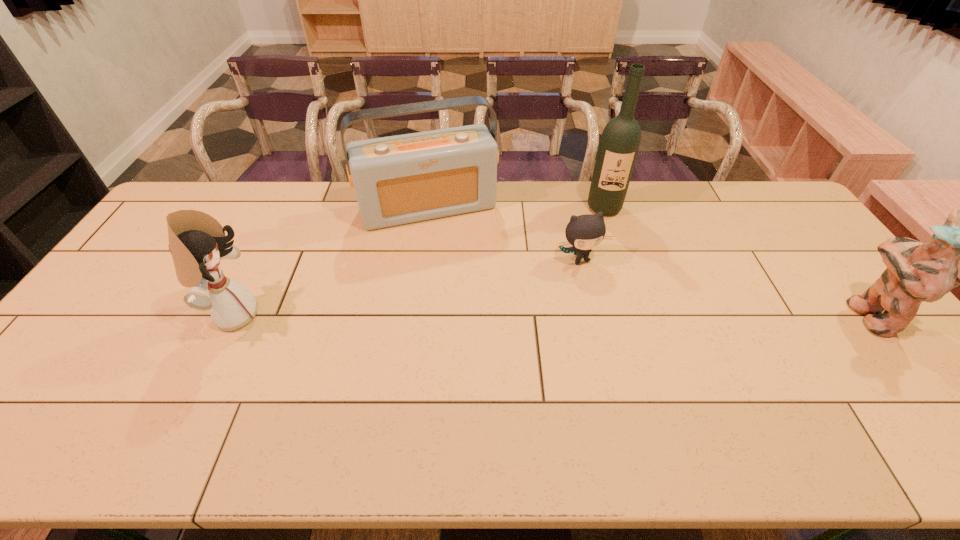
This screenshot has height=540, width=960. Find the location of `the leftmost object`. the leftmost object is located at coordinates (197, 241).

Locate an element on the screen. The width and height of the screenshot is (960, 540). the rightmost object is located at coordinates (916, 272).

You are a GUI agent. You are given a task and a screenshot of the screen. Output one action in this format:
    pyautogui.click(x=<x>, y=<y>)
    Task: Click on the radio receiver
    The image size is (960, 540).
    Given the screenshot: What is the action you would take?
    pyautogui.click(x=401, y=179)

Locate an element on the screen. This screenshot has height=540, width=960. the tallest object is located at coordinates (620, 140).

Locate an element on the screen. Image resolution: width=960 pixels, height=540 pixels. the shortest object is located at coordinates (584, 232).

Find the location of a particular element. kitten is located at coordinates (584, 232).

At what (x,y) coordinates should I click in order to perform the action: click on vacant space located 0.150m at the front face of the leftmost object. Please return your answer as a coordinate pair (x, y). This screenshot has width=960, height=540. Looking at the image, I should click on (314, 315).

This screenshot has height=540, width=960. Identify the location of vacant space situated on the front-facing side of the rightmost object. (828, 314).

The image size is (960, 540). In order to click on vacant space situated on the front-facing side of the rightmost object in this screenshot , I will do `click(777, 314)`.

Where is `vacant space located 0.210m on the front-facing side of the rightmost object`? The height and width of the screenshot is (540, 960). vacant space located 0.210m on the front-facing side of the rightmost object is located at coordinates (774, 314).